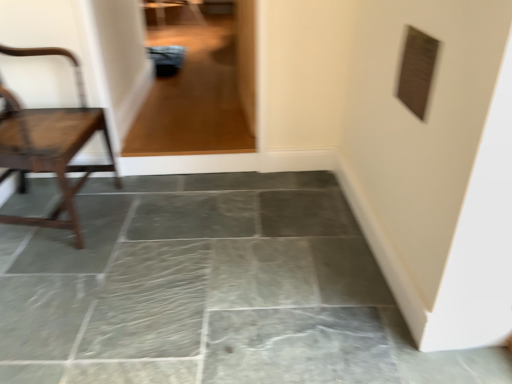
I want to click on vacant area that is in front of wooden chair at left, so 55,288.